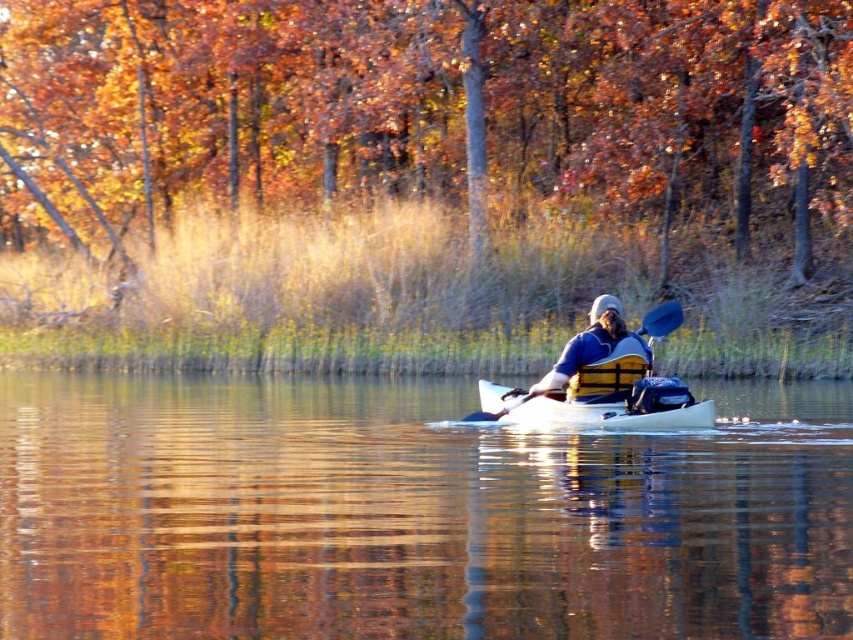
Question: Which point appears closest to the camera in this image?

Choices:
 (A) (364, 602)
 (B) (485, 196)

Answer: (A)

Question: Based on their relative distances, which object is farther from the white glossy kayak at center?

Choices:
 (A) blue fabric life vest at center
 (B) white matte canoe at center
 (C) brown matte tree at upper center

Answer: (C)

Question: Observing the image, what is the correct spatial positioning of brown matte tree at upper center in reference to blue fabric life vest at center?

Choices:
 (A) left
 (B) right

Answer: (A)

Question: Among these objects, which one is farthest from the camera?

Choices:
 (A) white matte canoe at center
 (B) white glossy kayak at center
 (C) brown matte tree at upper center
 (D) blue fabric life vest at center

Answer: (C)

Question: Is brown matte tree at upper center thinner than white matte canoe at center?

Choices:
 (A) no
 (B) yes

Answer: (A)

Question: Is white glossy kayak at center positioned at the back of brown matte tree at upper center?

Choices:
 (A) yes
 (B) no

Answer: (B)